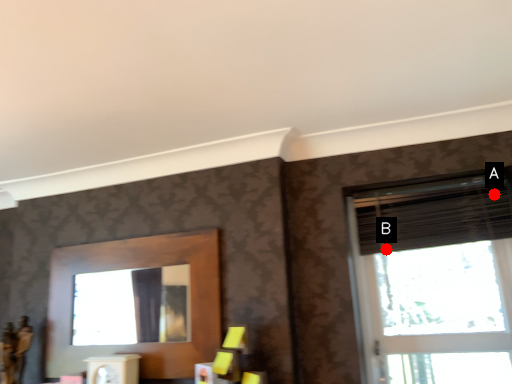
Question: Two points are circled on the image, labeled by A and B beside each circle. Which of the following is the closest to the observer?

Choices:
 (A) A is closer
 (B) B is closer

Answer: (A)